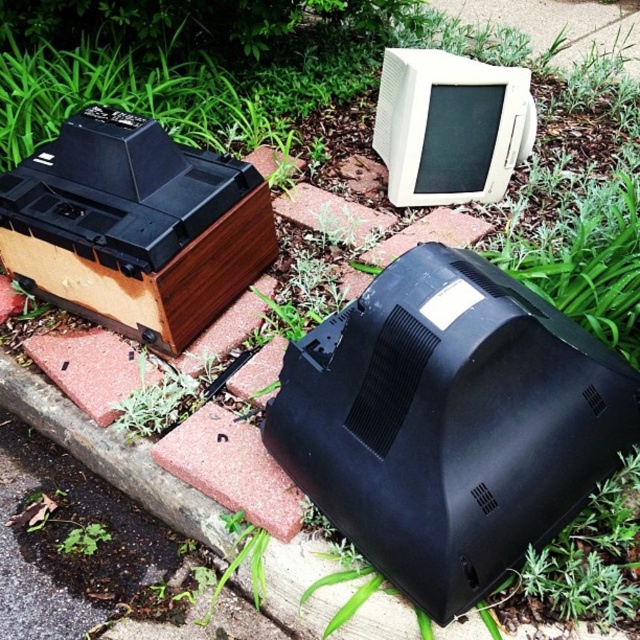
Question: Can you confirm if black matte monitor at center is positioned to the right of white plastic monitor at upper center?

Choices:
 (A) no
 (B) yes

Answer: (A)

Question: Does black matte monitor at center come behind white plastic monitor at upper center?

Choices:
 (A) yes
 (B) no

Answer: (B)

Question: Does black matte monitor at center lie in front of white plastic monitor at upper center?

Choices:
 (A) no
 (B) yes

Answer: (B)

Question: Among these points, which one is farthest from the camera?

Choices:
 (A) (582, 445)
 (B) (433, 145)

Answer: (B)